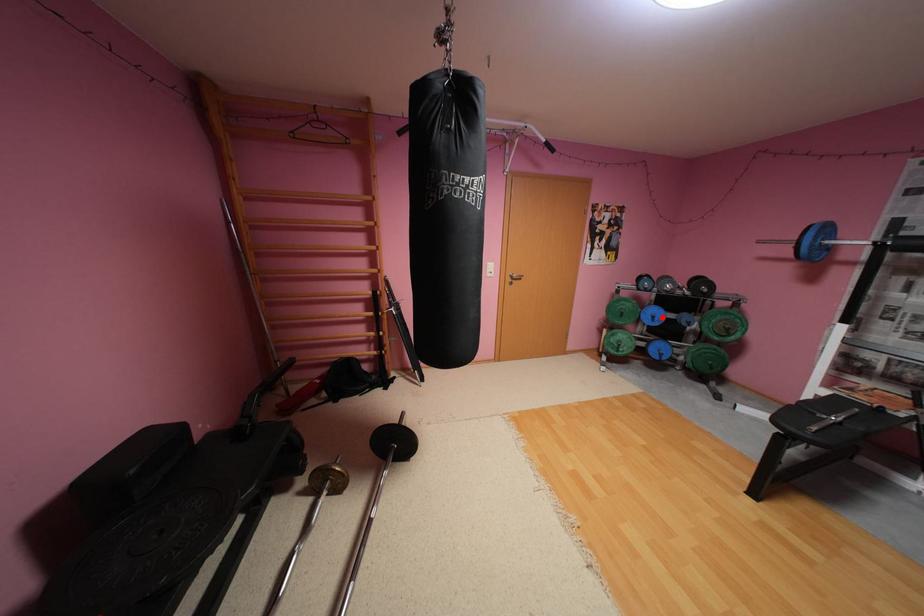
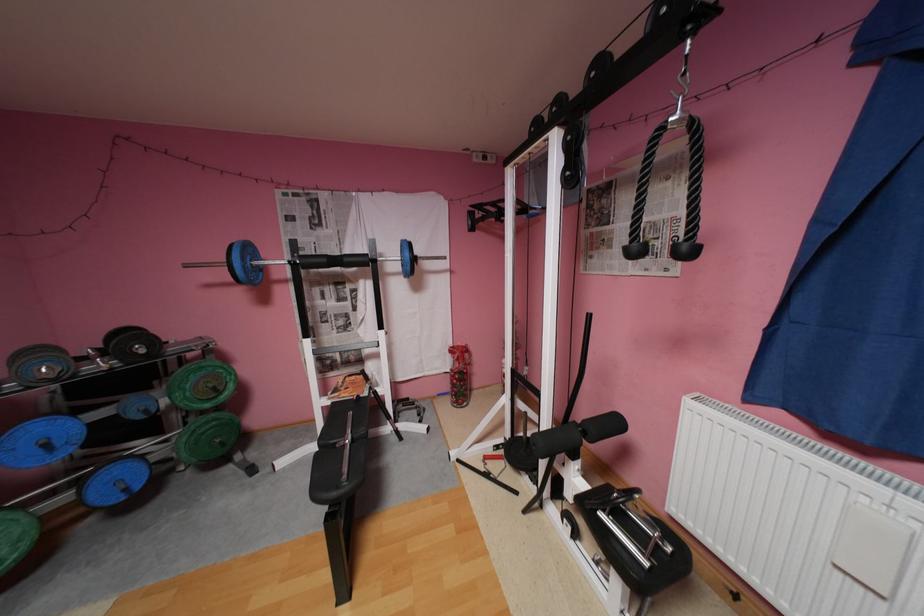
In the second image, find the point that corresponds to the highlighted location in the first image.

(55, 445)